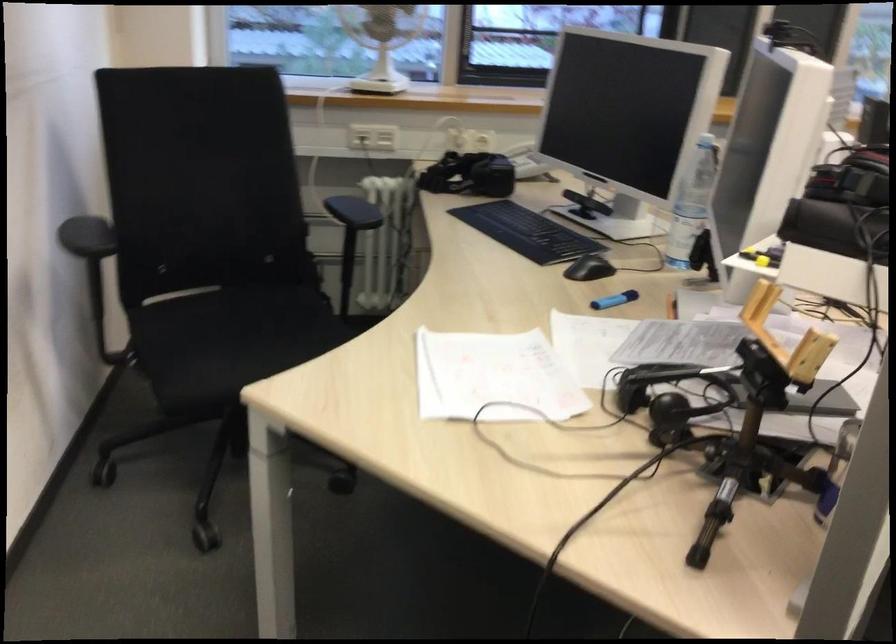
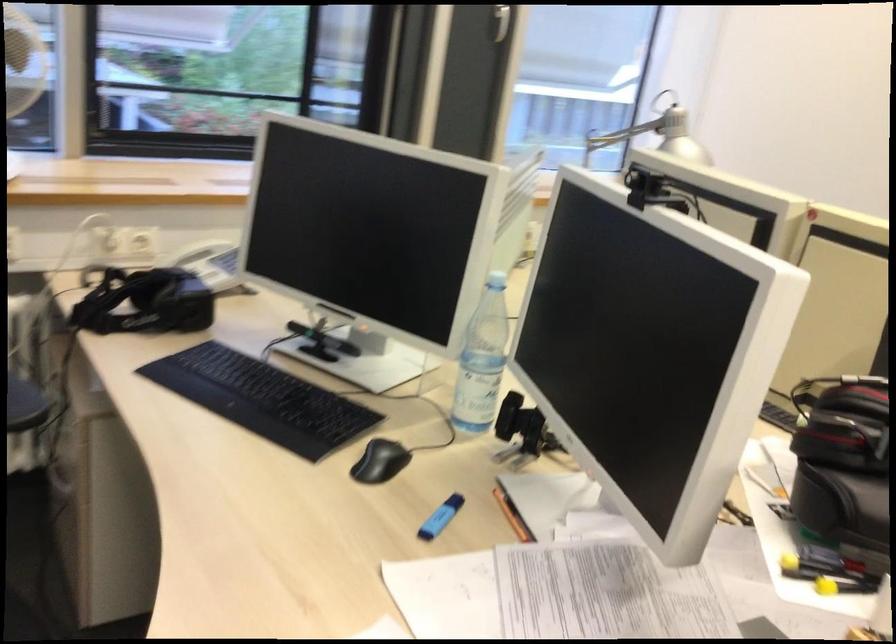
The images are taken continuously from a first-person perspective. In which direction are you moving?

The cameraman walked toward left, forward.